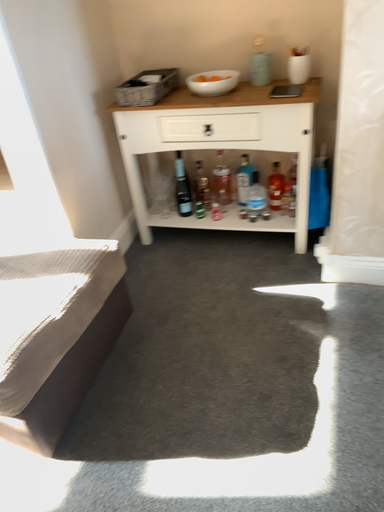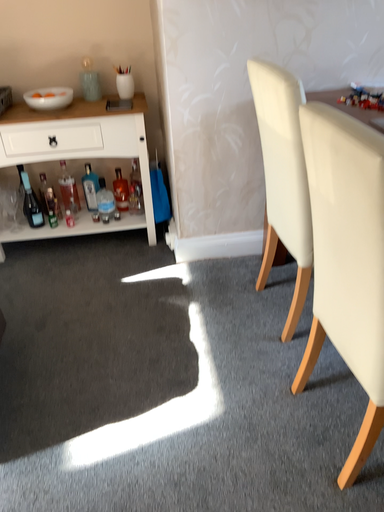
Question: Which way did the camera rotate in the video?

Choices:
 (A) rotated right
 (B) rotated left

Answer: (A)